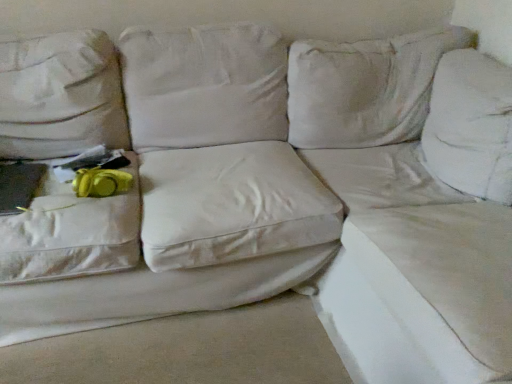
Where is `yellow fabric at left`? yellow fabric at left is located at coordinates (100, 182).

Who is smaller, yellow fabric at left or white fabric sheet at lower right, which is the second sheet from right to left?

yellow fabric at left.

Does yellow fabric at left lie behind white fabric sheet at lower right, which is counted as the first sheet, starting from the left?

Yes, the depth of yellow fabric at left is greater than that of white fabric sheet at lower right, which is counted as the first sheet, starting from the left.

Image resolution: width=512 pixels, height=384 pixels. Find the location of `stuff above the white fabric sheet at lower right, which is counted as the first sheet, starting from the left (from the image's perspective)`. stuff above the white fabric sheet at lower right, which is counted as the first sheet, starting from the left (from the image's perspective) is located at coordinates (100, 182).

Is yellow fabric at left not close to white fabric sheet at lower right, which is counted as the first sheet, starting from the left?

yellow fabric at left is actually quite close to white fabric sheet at lower right, which is counted as the first sheet, starting from the left.

Would you say white fabric sheet at lower right, which is counted as the first sheet, starting from the left, is a long distance from white fabric couch at upper right, positioned as the 2th sheet in left-to-right order?

white fabric sheet at lower right, which is counted as the first sheet, starting from the left, is actually quite close to white fabric couch at upper right, positioned as the 2th sheet in left-to-right order.

Do you think white fabric sheet at lower right, which is the second sheet from right to left, is within white fabric couch at upper right, positioned as the 2th sheet in left-to-right order, or outside of it?

white fabric sheet at lower right, which is the second sheet from right to left, cannot be found inside white fabric couch at upper right, positioned as the 2th sheet in left-to-right order.

Is white fabric sheet at lower right, which is the second sheet from right to left, aimed at white fabric couch at upper right, acting as the first sheet starting from the right?

Yes, white fabric sheet at lower right, which is the second sheet from right to left, is facing white fabric couch at upper right, acting as the first sheet starting from the right.

Between point (66, 326) and point (395, 373), which one is positioned in front?

The point (395, 373) is closer.

Relative to white fabric sheet at lower right, which is counted as the first sheet, starting from the left, is white fabric couch at upper right, acting as the first sheet starting from the right, in front or behind?

white fabric couch at upper right, acting as the first sheet starting from the right, is positioned closer to the viewer than white fabric sheet at lower right, which is counted as the first sheet, starting from the left.

Can you confirm if white fabric couch at upper right, acting as the first sheet starting from the right, is bigger than white fabric sheet at lower right, which is counted as the first sheet, starting from the left?

Yes.

Consider the image. Does white fabric couch at upper right, acting as the first sheet starting from the right, have a greater height compared to white fabric sheet at lower right, which is counted as the first sheet, starting from the left?

Yes.

Can you see white fabric couch at upper right, positioned as the 2th sheet in left-to-right order, touching white fabric sheet at lower right, which is the second sheet from right to left?

No.

From a real-world perspective, between white fabric sheet at lower right, which is counted as the first sheet, starting from the left, and yellow fabric at left, who is vertically higher?

yellow fabric at left is physically above.

Does white fabric sheet at lower right, which is counted as the first sheet, starting from the left, have a greater height compared to yellow fabric at left?

Yes.

From the image's perspective, between white fabric sheet at lower right, which is counted as the first sheet, starting from the left, and yellow fabric at left, which one is located above?

From the image's view, yellow fabric at left is above.

Which is nearer, (276, 279) or (106, 193)?

Point (276, 279).

From a real-world perspective, is yellow fabric at left above or below white fabric couch at upper right, acting as the first sheet starting from the right?

yellow fabric at left is above white fabric couch at upper right, acting as the first sheet starting from the right.

The height and width of the screenshot is (384, 512). In order to click on stuff to the left of white fabric couch at upper right, positioned as the 2th sheet in left-to-right order in this screenshot , I will do `click(100, 182)`.

Is yellow fabric at left closer to camera compared to white fabric couch at upper right, acting as the first sheet starting from the right?

No, it is not.

Can you confirm if white fabric couch at upper right, acting as the first sheet starting from the right, is smaller than yellow fabric at left?

No, white fabric couch at upper right, acting as the first sheet starting from the right, is not smaller than yellow fabric at left.

From a real-world perspective, is white fabric couch at upper right, positioned as the 2th sheet in left-to-right order, above or below yellow fabric at left?

Clearly, from a real-world perspective, white fabric couch at upper right, positioned as the 2th sheet in left-to-right order, is below yellow fabric at left.

How different are the orientations of white fabric couch at upper right, acting as the first sheet starting from the right, and yellow fabric at left in degrees?

92.1 degrees.

Measure the distance between white fabric couch at upper right, acting as the first sheet starting from the right, and yellow fabric at left.

They are 36.53 inches apart.

Identify the location of stuff lying behind the white fabric sheet at lower right, which is counted as the first sheet, starting from the left. (100, 182).

The width and height of the screenshot is (512, 384). Find the location of `sheet above the white fabric sheet at lower right, which is the second sheet from right to left (from the image's perspective)`. sheet above the white fabric sheet at lower right, which is the second sheet from right to left (from the image's perspective) is located at coordinates (425, 293).

Estimate the real-world distances between objects in this image. Which object is closer to yellow fabric at left, white fabric sheet at lower right, which is the second sheet from right to left, or white fabric couch at upper right, acting as the first sheet starting from the right?

Based on the image, white fabric sheet at lower right, which is the second sheet from right to left, appears to be nearer to yellow fabric at left.

Looking at the image, which one is located further to white fabric sheet at lower right, which is counted as the first sheet, starting from the left, yellow fabric at left or white fabric couch at upper right, positioned as the 2th sheet in left-to-right order?

white fabric couch at upper right, positioned as the 2th sheet in left-to-right order, is further to white fabric sheet at lower right, which is counted as the first sheet, starting from the left.

Looking at the image, which one is located closer to yellow fabric at left, white fabric couch at upper right, acting as the first sheet starting from the right, or white fabric sheet at lower right, which is counted as the first sheet, starting from the left?

Among the two, white fabric sheet at lower right, which is counted as the first sheet, starting from the left, is located nearer to yellow fabric at left.

From the image, which object appears to be nearer to white fabric couch at upper right, acting as the first sheet starting from the right, yellow fabric at left or white fabric sheet at lower right, which is the second sheet from right to left?

The object closer to white fabric couch at upper right, acting as the first sheet starting from the right, is white fabric sheet at lower right, which is the second sheet from right to left.

Which object lies further to the anchor point white fabric sheet at lower right, which is counted as the first sheet, starting from the left, white fabric couch at upper right, positioned as the 2th sheet in left-to-right order, or yellow fabric at left?

white fabric couch at upper right, positioned as the 2th sheet in left-to-right order.

Looking at the image, which one is located closer to white fabric couch at upper right, acting as the first sheet starting from the right, white fabric sheet at lower right, which is the second sheet from right to left, or yellow fabric at left?

Among the two, white fabric sheet at lower right, which is the second sheet from right to left, is located nearer to white fabric couch at upper right, acting as the first sheet starting from the right.

This screenshot has width=512, height=384. What are the coordinates of `sheet between yellow fabric at left and white fabric couch at upper right, acting as the first sheet starting from the right, in the horizontal direction` in the screenshot? It's located at (149, 294).